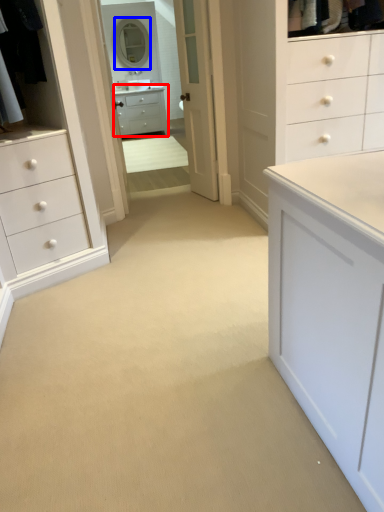
Question: Which object is further to the camera taking this photo, chest of drawers (highlighted by a red box) or mirror (highlighted by a blue box)?

Choices:
 (A) chest of drawers
 (B) mirror

Answer: (A)